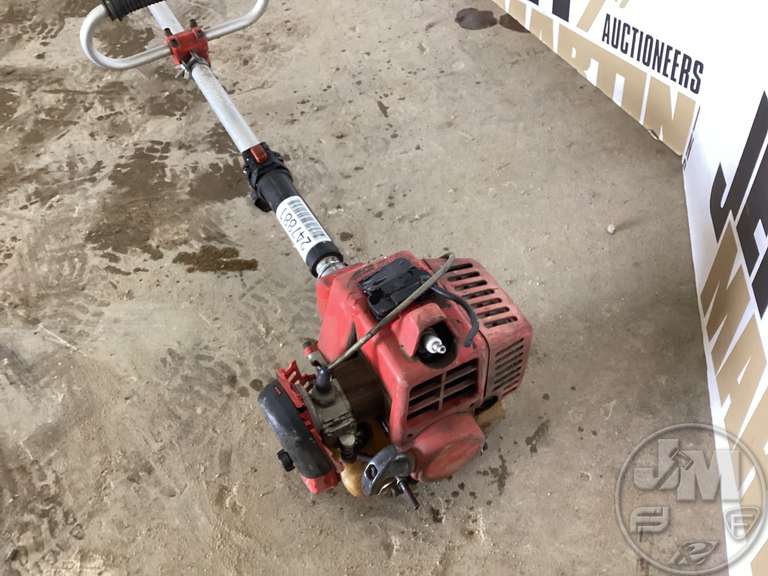
You are a GUI agent. You are given a task and a screenshot of the screen. Output one action in this format:
    pyautogui.click(x=<x>, y=<y>)
    Task: Click on the exhaust fans
    The width and height of the screenshot is (768, 576).
    Given the screenshot: What is the action you would take?
    pyautogui.click(x=488, y=306), pyautogui.click(x=441, y=397)